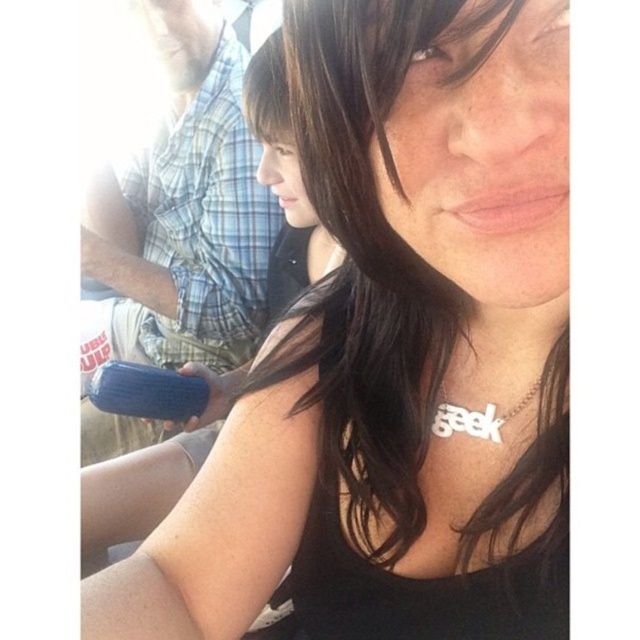
You are a photographer trying to capture a closeup of the silver metallic necklace at center while also including the blue rubber object at center in the frame. Based on their positions, will you need to adjust your camera to the right or left to include both items in the shot?

The blue rubber object at center is to the left of the silver metallic necklace at center. To include both in the frame, you should adjust your camera to the left to capture the blue rubber object at center and the silver metallic necklace at center.